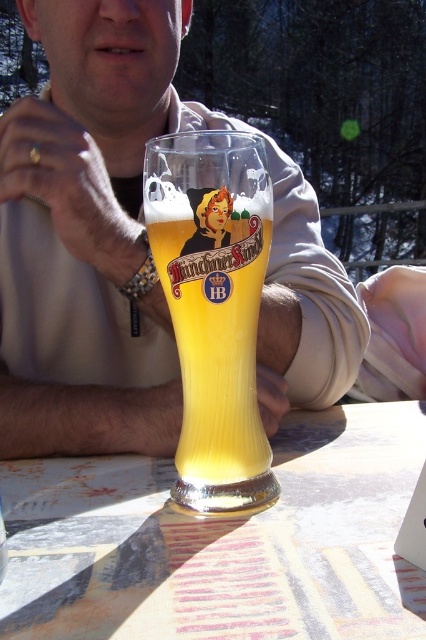
You are a bartender who needs to place a coaster under the matte glass beer at center to prevent condensation from damaging the translucent glass table at center. Is the coaster already placed correctly under the beer?

The matte glass beer at center is above the translucent glass table at center, so the coaster is not placed correctly. The coaster should be between the beer and the table to protect it from condensation.

You are trying to place a coaster under the translucent glass beer glass at center on the translucent glass table at center. Considering their heights, will the coaster stay flat on the table without tilting?

The translucent glass table at center is not as tall as the translucent glass beer glass at center, meaning the table is shorter in height. Since the coaster is placed on the table, the height difference between the table and the beer glass does not affect the coaster stability. The coaster should stay flat.